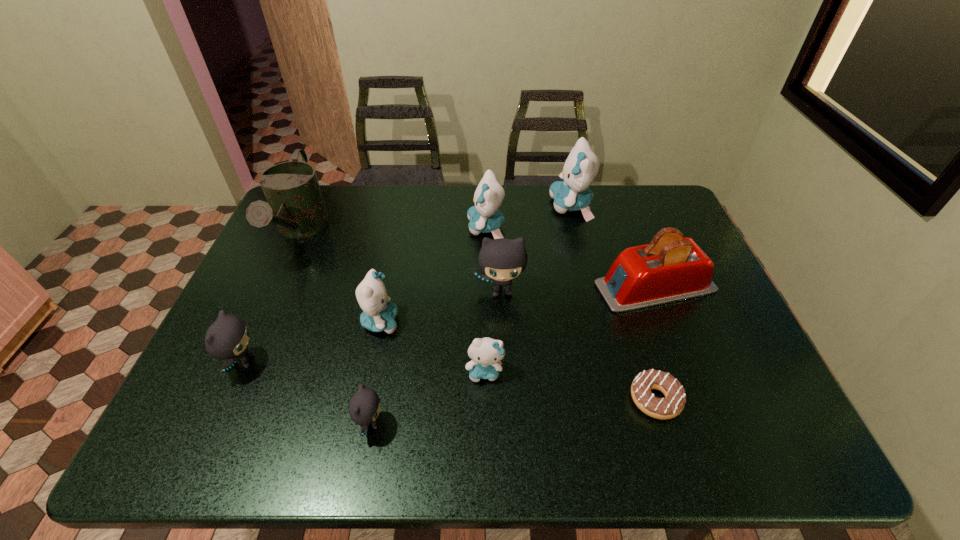
Identify the location of the second nearest gray kitten. Image resolution: width=960 pixels, height=540 pixels. (227, 338).

Locate an element on the screen. the smallest blue kitten is located at coordinates (486, 353).

Where is `the nearest gray kitten`? This screenshot has width=960, height=540. the nearest gray kitten is located at coordinates pyautogui.click(x=364, y=407).

The image size is (960, 540). I want to click on the smallest gray kitten, so click(x=364, y=407).

The image size is (960, 540). I want to click on the shortest object, so click(672, 405).

This screenshot has width=960, height=540. I want to click on doughnut, so click(x=672, y=405).

Identify the location of vacant space located 0.360m on the face of the rightmost kitten. This screenshot has height=540, width=960. (444, 206).

Find the location of `vacant space situated on the face of the rightmost kitten`. vacant space situated on the face of the rightmost kitten is located at coordinates (523, 206).

Where is `vacant space located 0.140m on the face of the rightmost kitten`? vacant space located 0.140m on the face of the rightmost kitten is located at coordinates pyautogui.click(x=509, y=206).

Where is `free space located 0.260m with the spout on the green watering can`? Image resolution: width=960 pixels, height=540 pixels. free space located 0.260m with the spout on the green watering can is located at coordinates (247, 350).